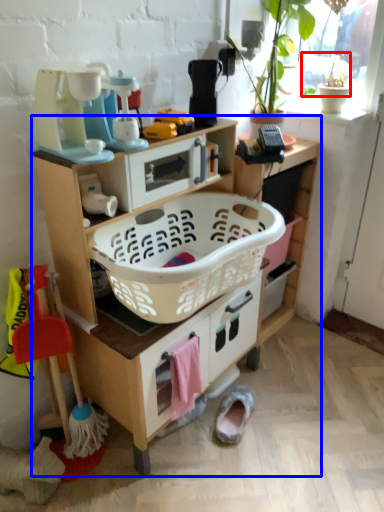
Question: Which point is closer to the camera, plant (highlighted by a red box) or shelf (highlighted by a blue box)?

Choices:
 (A) plant
 (B) shelf

Answer: (B)